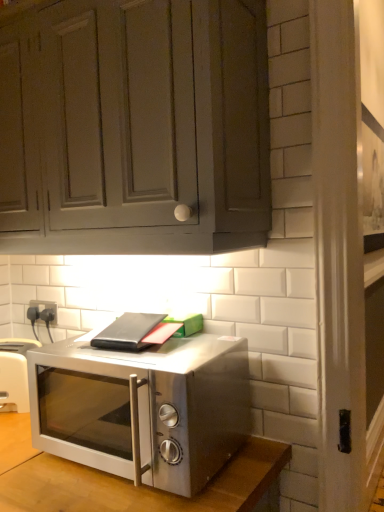
Question: Considering the relative sizes of satin silver microwave at center and satin silver toaster at lower left in the image provided, is satin silver microwave at center wider than satin silver toaster at lower left?

Choices:
 (A) no
 (B) yes

Answer: (B)

Question: Considering the relative positions of satin silver microwave at center and satin silver toaster at lower left in the image provided, is satin silver microwave at center to the left of satin silver toaster at lower left from the viewer's perspective?

Choices:
 (A) no
 (B) yes

Answer: (A)

Question: Is satin silver microwave at center facing towards satin silver toaster at lower left?

Choices:
 (A) no
 (B) yes

Answer: (A)

Question: From a real-world perspective, is satin silver microwave at center located beneath satin silver toaster at lower left?

Choices:
 (A) yes
 (B) no

Answer: (B)

Question: Is satin silver microwave at center shorter than satin silver toaster at lower left?

Choices:
 (A) yes
 (B) no

Answer: (B)

Question: Is matte gray cabinet at upper center bigger or smaller than satin silver toaster at lower left?

Choices:
 (A) small
 (B) big

Answer: (B)

Question: Based on their positions, is matte gray cabinet at upper center located to the left or right of satin silver toaster at lower left?

Choices:
 (A) right
 (B) left

Answer: (A)

Question: Is matte gray cabinet at upper center situated inside satin silver toaster at lower left or outside?

Choices:
 (A) inside
 (B) outside

Answer: (B)

Question: From a real-world perspective, is matte gray cabinet at upper center positioned above or below satin silver toaster at lower left?

Choices:
 (A) below
 (B) above

Answer: (B)

Question: Does point (261, 182) appear closer or farther from the camera than point (110, 472)?

Choices:
 (A) farther
 (B) closer

Answer: (A)

Question: In the image, is matte gray cabinet at upper center positioned in front of or behind satin silver microwave at center?

Choices:
 (A) front
 (B) behind

Answer: (A)

Question: Looking at their shapes, would you say matte gray cabinet at upper center is wider or thinner than satin silver microwave at center?

Choices:
 (A) wide
 (B) thin

Answer: (B)

Question: From the image's perspective, is matte gray cabinet at upper center located above or below satin silver microwave at center?

Choices:
 (A) below
 (B) above

Answer: (B)

Question: From a real-world perspective, relative to matte gray cabinet at upper center, is satin silver microwave at center vertically above or below?

Choices:
 (A) above
 (B) below

Answer: (B)

Question: Considering the positions of point (180, 484) and point (259, 176), is point (180, 484) closer or farther from the camera than point (259, 176)?

Choices:
 (A) closer
 (B) farther

Answer: (A)